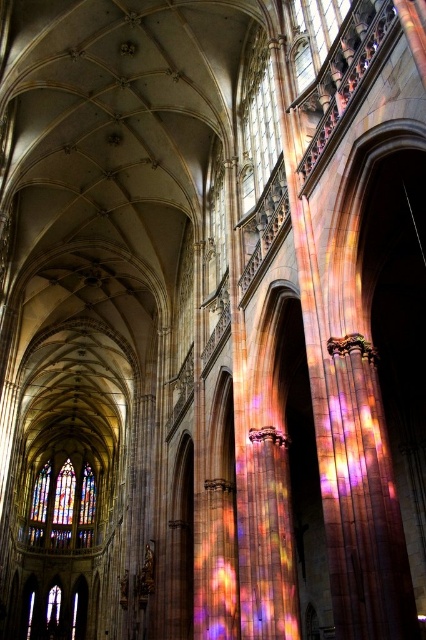
Question: Considering the relative positions of stained glass window at left and transparent stained glass at upper center in the image provided, where is stained glass window at left located with respect to transparent stained glass at upper center?

Choices:
 (A) above
 (B) below

Answer: (B)

Question: Is stained glass window at left to the left of transparent stained glass at upper center from the viewer's perspective?

Choices:
 (A) yes
 (B) no

Answer: (A)

Question: Among these objects, which one is farthest from the camera?

Choices:
 (A) transparent stained glass at upper center
 (B) stained glass window at left

Answer: (B)

Question: Does stained glass window at left lie behind transparent stained glass at upper center?

Choices:
 (A) yes
 (B) no

Answer: (A)

Question: Which point appears farthest from the camera in this image?

Choices:
 (A) (273, 104)
 (B) (74, 499)

Answer: (B)